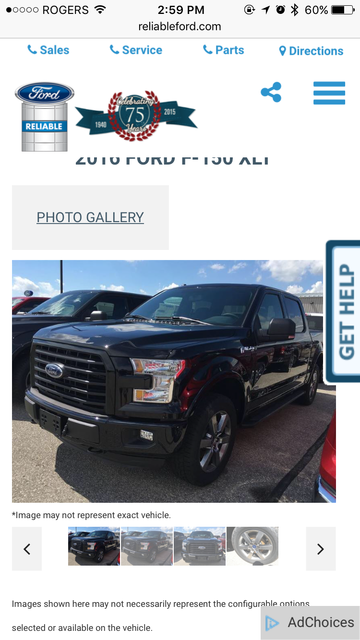
Identify the location of photo gallery. This screenshot has height=640, width=360. (111, 211).